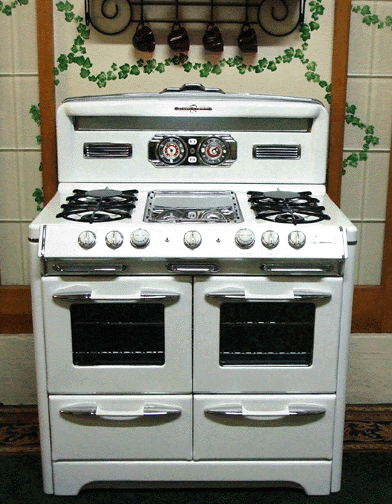
Image resolution: width=392 pixels, height=504 pixels. What are the coordinates of `oven racks on left side` in the screenshot? It's located at (112, 321), (114, 352).